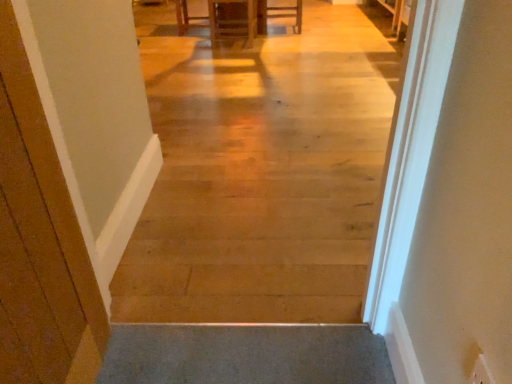
At what (x,y) coordinates should I click in order to perform the action: click on matte wooden chair at center, which is counted as the 2th furniture, starting from the front. Please return your answer as a coordinate pair (x, y). The image size is (512, 384). Looking at the image, I should click on (289, 15).

The height and width of the screenshot is (384, 512). Describe the element at coordinates (262, 175) in the screenshot. I see `wooden floor at center` at that location.

The height and width of the screenshot is (384, 512). What are the coordinates of `wooden table at center` in the screenshot? It's located at (184, 16).

From a real-world perspective, does wooden floor at center sit lower than matte wood cabinet at center, which is counted as the 2th furniture, starting from the right?

No, from a real-world perspective, wooden floor at center is not below matte wood cabinet at center, which is counted as the 2th furniture, starting from the right.

In the image, is wooden floor at center positioned in front of or behind matte wood cabinet at center, the first furniture in the front-to-back sequence?

Clearly, wooden floor at center is in front of matte wood cabinet at center, the first furniture in the front-to-back sequence.

Locate an element on the screen. This screenshot has width=512, height=384. aisle below the matte wood cabinet at center, the first furniture positioned from the left (from the image's perspective) is located at coordinates (262, 175).

Is matte wood cabinet at center, the first furniture positioned from the left, at the back of wooden floor at center?

No, wooden floor at center's orientation is not away from matte wood cabinet at center, the first furniture positioned from the left.

Looking at this image, does matte wooden chair at center, positioned as the first furniture in right-to-left order, have a lesser height compared to wooden table at center?

Yes, matte wooden chair at center, positioned as the first furniture in right-to-left order, is shorter than wooden table at center.

Can you see matte wooden chair at center, marked as the 2th furniture in a left-to-right arrangement, touching wooden table at center?

No, matte wooden chair at center, marked as the 2th furniture in a left-to-right arrangement, is not with wooden table at center.

Which of these two, matte wooden chair at center, marked as the 2th furniture in a left-to-right arrangement, or wooden table at center, is bigger?

wooden table at center is bigger.

Is point (250, 9) closer or farther from the camera than point (173, 264)?

Point (250, 9) appears to be farther away from the viewer than point (173, 264).

Between matte wood cabinet at center, the 2th furniture from the back, and wooden floor at center, which one has smaller size?

matte wood cabinet at center, the 2th furniture from the back.

Visually, is matte wood cabinet at center, which is counted as the 2th furniture, starting from the right, positioned to the left or to the right of wooden floor at center?

matte wood cabinet at center, which is counted as the 2th furniture, starting from the right, is positioned on wooden floor at center's left side.

Which is in front, point (182, 29) or point (234, 36)?

Positioned in front is point (234, 36).

Are wooden table at center and matte wood cabinet at center, the first furniture in the front-to-back sequence, located far from each other?

Actually, wooden table at center and matte wood cabinet at center, the first furniture in the front-to-back sequence, are a little close together.

Considering the relative positions of wooden table at center and matte wood cabinet at center, the 2th furniture from the back, in the image provided, is wooden table at center to the right of matte wood cabinet at center, the 2th furniture from the back, from the viewer's perspective?

Correct, you'll find wooden table at center to the right of matte wood cabinet at center, the 2th furniture from the back.

Which of these two, wooden table at center or matte wood cabinet at center, the 2th furniture from the back, stands shorter?

With less height is wooden table at center.

Between matte wooden chair at center, positioned as the first furniture in right-to-left order, and matte wood cabinet at center, the first furniture in the front-to-back sequence, which one has larger size?

matte wood cabinet at center, the first furniture in the front-to-back sequence.

Is point (278, 15) farther from viewer compared to point (223, 2)?

No.

Find the location of a particular element. This screenshot has width=512, height=384. furniture in front of the matte wooden chair at center, which is the 1th furniture from back to front is located at coordinates (232, 20).

Between matte wooden chair at center, positioned as the first furniture in right-to-left order, and matte wood cabinet at center, the first furniture positioned from the left, which one is positioned in front?

Positioned in front is matte wood cabinet at center, the first furniture positioned from the left.

Considering the positions of points (257, 86) and (300, 16), is point (257, 86) farther from camera compared to point (300, 16)?

No, (257, 86) is in front of (300, 16).

The height and width of the screenshot is (384, 512). Identify the location of furniture that is the 2nd object located behind the wooden floor at center. (289, 15).

Could you measure the distance between wooden floor at center and matte wooden chair at center, which is counted as the 2th furniture, starting from the front?

A distance of 2.10 meters exists between wooden floor at center and matte wooden chair at center, which is counted as the 2th furniture, starting from the front.

Is wooden table at center oriented away from matte wooden chair at center, positioned as the first furniture in right-to-left order?

wooden table at center is not turned away from matte wooden chair at center, positioned as the first furniture in right-to-left order.

Are wooden table at center and matte wooden chair at center, marked as the 2th furniture in a left-to-right arrangement, beside each other?

No, wooden table at center is not touching matte wooden chair at center, marked as the 2th furniture in a left-to-right arrangement.

Is wooden table at center to the left or to the right of matte wooden chair at center, marked as the 2th furniture in a left-to-right arrangement, in the image?

In the image, wooden table at center appears on the left side of matte wooden chair at center, marked as the 2th furniture in a left-to-right arrangement.

At what (x,y) coordinates should I click in order to perform the action: click on table in front of the matte wooden chair at center, positioned as the first furniture in right-to-left order. Please return your answer as a coordinate pair (x, y). This screenshot has height=384, width=512. Looking at the image, I should click on (184, 16).

At what (x,y) coordinates should I click in order to perform the action: click on the 1st furniture positioned above the wooden floor at center (from the image's perspective). Please return your answer as a coordinate pair (x, y). The image size is (512, 384). Looking at the image, I should click on (232, 20).

This screenshot has height=384, width=512. I want to click on furniture below the wooden table at center (from a real-world perspective), so click(289, 15).

In the scene shown: Considering their positions, is wooden floor at center positioned closer to matte wood cabinet at center, the first furniture in the front-to-back sequence, than matte wooden chair at center, which is counted as the 2th furniture, starting from the front?

matte wooden chair at center, which is counted as the 2th furniture, starting from the front, is positioned closer to the anchor matte wood cabinet at center, the first furniture in the front-to-back sequence.

From the image, which object appears to be farther from matte wood cabinet at center, the first furniture in the front-to-back sequence, wooden floor at center or wooden table at center?

wooden floor at center is positioned further to the anchor matte wood cabinet at center, the first furniture in the front-to-back sequence.

When comparing their distances from wooden table at center, does matte wood cabinet at center, the first furniture positioned from the left, or wooden floor at center seem further?

Among the two, wooden floor at center is located further to wooden table at center.

When comparing their distances from wooden table at center, does wooden floor at center or matte wooden chair at center, which is the 1th furniture from back to front, seem further?

wooden floor at center is positioned further to the anchor wooden table at center.

Consider the image. When comparing their distances from wooden floor at center, does matte wooden chair at center, positioned as the first furniture in right-to-left order, or matte wood cabinet at center, which is counted as the 2th furniture, starting from the right, seem closer?

The object closer to wooden floor at center is matte wood cabinet at center, which is counted as the 2th furniture, starting from the right.

Considering their positions, is wooden table at center positioned closer to matte wood cabinet at center, the first furniture positioned from the left, than matte wooden chair at center, positioned as the first furniture in right-to-left order?

wooden table at center.

When comparing their distances from matte wood cabinet at center, the first furniture positioned from the left, does matte wooden chair at center, positioned as the first furniture in right-to-left order, or wooden floor at center seem further?

The object further to matte wood cabinet at center, the first furniture positioned from the left, is wooden floor at center.

When comparing their distances from matte wooden chair at center, positioned as the first furniture in right-to-left order, does wooden floor at center or matte wood cabinet at center, the first furniture in the front-to-back sequence, seem closer?

The object closer to matte wooden chair at center, positioned as the first furniture in right-to-left order, is matte wood cabinet at center, the first furniture in the front-to-back sequence.

Find the location of a particular element. This screenshot has height=384, width=512. table located between wooden floor at center and matte wooden chair at center, marked as the 2th furniture in a left-to-right arrangement, in the depth direction is located at coordinates (184, 16).

Find the location of a particular element. The height and width of the screenshot is (384, 512). table between matte wood cabinet at center, the first furniture positioned from the left, and matte wooden chair at center, marked as the 2th furniture in a left-to-right arrangement, from left to right is located at coordinates (184, 16).

Identify the location of furniture between wooden floor at center and matte wooden chair at center, which is counted as the 2th furniture, starting from the front, from front to back. (232, 20).

The image size is (512, 384). In order to click on furniture between wooden floor at center and wooden table at center along the z-axis in this screenshot , I will do `click(232, 20)`.